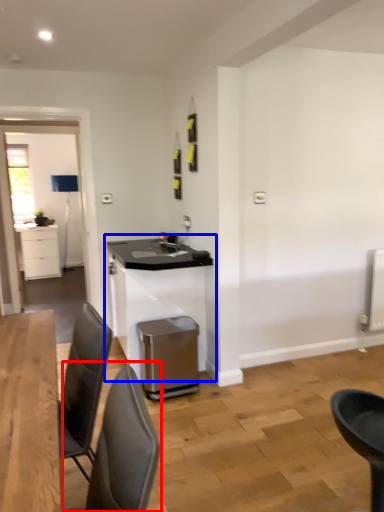
Question: Among these objects, which one is nearest to the camera, chair (highlighted by a red box) or table (highlighted by a blue box)?

Choices:
 (A) chair
 (B) table

Answer: (A)